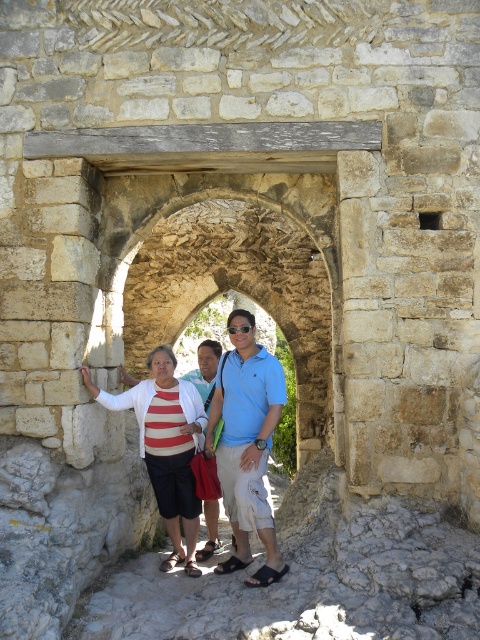
Question: Is striped fabric sweater at center wider than blue cotton polo shirt at center?

Choices:
 (A) no
 (B) yes

Answer: (B)

Question: Can you confirm if striped fabric sweater at center is positioned to the left of blue cotton polo shirt at center?

Choices:
 (A) no
 (B) yes

Answer: (B)

Question: Is striped fabric sweater at center below blue cotton polo shirt at center?

Choices:
 (A) no
 (B) yes

Answer: (A)

Question: Among these objects, which one is farthest from the camera?

Choices:
 (A) striped fabric sweater at center
 (B) blue cotton polo shirt at center

Answer: (A)

Question: Which object is farther from the camera taking this photo?

Choices:
 (A) striped fabric sweater at center
 (B) blue cotton polo shirt at center

Answer: (A)

Question: Which object is farther from the camera taking this photo?

Choices:
 (A) striped fabric sweater at center
 (B) blue cotton polo shirt at center

Answer: (A)